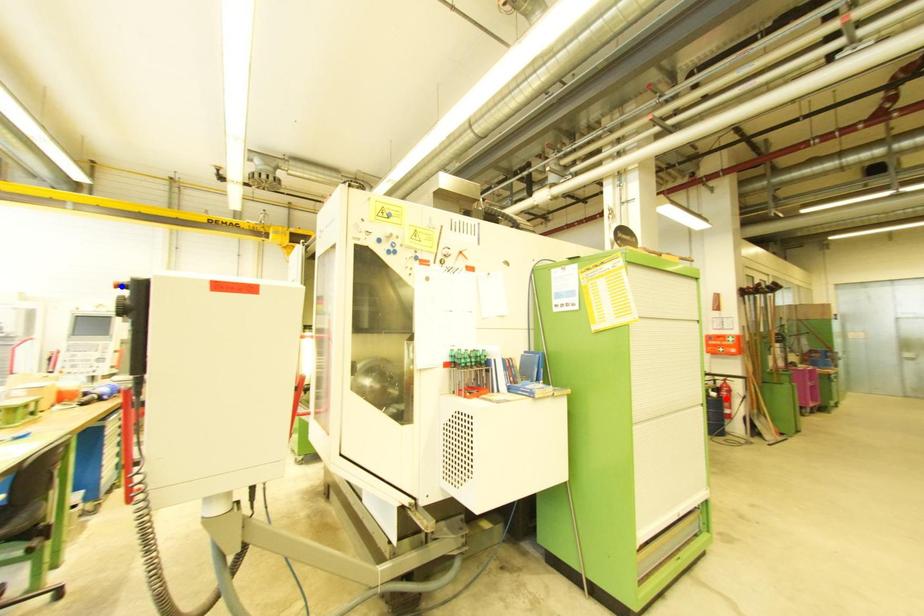
Question: Two points are marked on the image. Which point is closer to the camera?

Choices:
 (A) Blue point is closer.
 (B) Red point is closer.

Answer: (A)